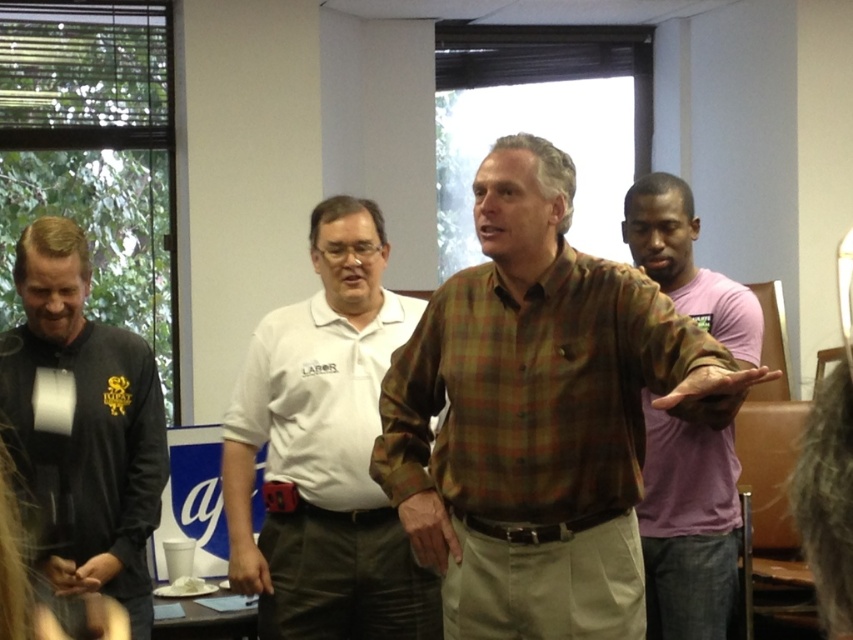
What do you see at coordinates (538, 416) in the screenshot? I see `plaid cotton shirt at center` at bounding box center [538, 416].

Can you confirm if plaid cotton shirt at center is positioned below white cotton shirt at center?

Actually, plaid cotton shirt at center is above white cotton shirt at center.

Which is in front, point (496, 273) or point (352, 531)?

Point (496, 273)

This screenshot has width=853, height=640. I want to click on plaid cotton shirt at center, so click(538, 416).

Between black matte polo shirt at left and camo fabric shirt at right, which one has less height?

With less height is black matte polo shirt at left.

Who is more forward, (105, 556) or (630, 227)?

Point (105, 556) is in front.

Where is `black matte polo shirt at left`? black matte polo shirt at left is located at coordinates (84, 426).

Is the position of white cotton shirt at center more distant than that of camo fabric shirt at right?

No, white cotton shirt at center is in front of camo fabric shirt at right.

Between point (347, 483) and point (697, 227), which one is positioned in front?

Point (347, 483) is more forward.

I want to click on white cotton shirt at center, so click(x=323, y=451).